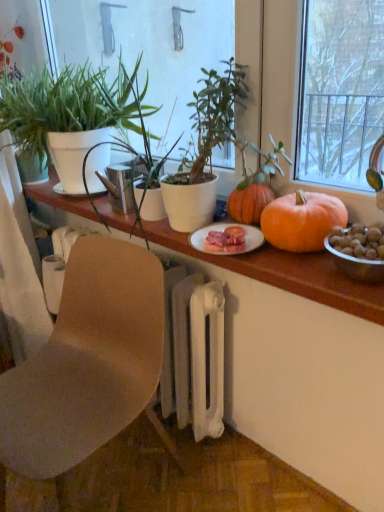
Question: Looking at their shapes, would you say green matte plant at center, the 2th houseplant in the left-to-right sequence, is wider or thinner than wooden table at center?

Choices:
 (A) thin
 (B) wide

Answer: (A)

Question: Is point (142, 117) positioned closer to the camera than point (327, 253)?

Choices:
 (A) farther
 (B) closer

Answer: (A)

Question: Considering the real-world distances, which object is closest to the green matte plant at center, the 2th houseplant in the left-to-right sequence?

Choices:
 (A) wooden table at center
 (B) brown matte chair at lower left
 (C) orange matte pumpkin at center
 (D) green matte plant at left, positioned as the 2th houseplant in right-to-left order

Answer: (D)

Question: Which of these objects is positioned farthest from the orange matte pumpkin at center?

Choices:
 (A) green matte plant at left, positioned as the 2th houseplant in right-to-left order
 (B) wooden table at center
 (C) green matte plant at center, the 2th houseplant in the left-to-right sequence
 (D) brown matte chair at lower left

Answer: (A)